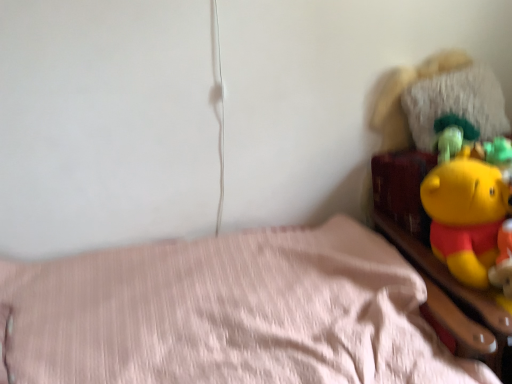
Question: Does yellow plush toy at upper right have a lesser height compared to fuzzy white pillow at upper right?

Choices:
 (A) yes
 (B) no

Answer: (B)

Question: Is fuzzy white pillow at upper right completely or partially inside yellow plush toy at upper right?

Choices:
 (A) no
 (B) yes

Answer: (A)

Question: Can you confirm if yellow plush toy at upper right is wider than fuzzy white pillow at upper right?

Choices:
 (A) no
 (B) yes

Answer: (B)

Question: Are yellow plush toy at upper right and fuzzy white pillow at upper right far apart?

Choices:
 (A) no
 (B) yes

Answer: (A)

Question: Considering the relative sizes of yellow plush toy at upper right and fuzzy white pillow at upper right in the image provided, is yellow plush toy at upper right bigger than fuzzy white pillow at upper right?

Choices:
 (A) no
 (B) yes

Answer: (B)

Question: From a real-world perspective, is yellow plush toy at upper right physically below fuzzy white pillow at upper right?

Choices:
 (A) yes
 (B) no

Answer: (A)

Question: Is the depth of yellow plush toy at upper right greater than that of pink fabric bed at lower left?

Choices:
 (A) yes
 (B) no

Answer: (A)

Question: Is yellow plush toy at upper right placed right next to pink fabric bed at lower left?

Choices:
 (A) yes
 (B) no

Answer: (B)

Question: Considering the relative positions of yellow plush toy at upper right and pink fabric bed at lower left in the image provided, is yellow plush toy at upper right to the right of pink fabric bed at lower left from the viewer's perspective?

Choices:
 (A) yes
 (B) no

Answer: (A)

Question: Is yellow plush toy at upper right not inside pink fabric bed at lower left?

Choices:
 (A) yes
 (B) no

Answer: (A)

Question: Is yellow plush toy at upper right turned away from pink fabric bed at lower left?

Choices:
 (A) yes
 (B) no

Answer: (B)

Question: Is yellow plush toy at upper right positioned in front of pink fabric bed at lower left?

Choices:
 (A) no
 (B) yes

Answer: (A)

Question: Is fuzzy white pillow at upper right surrounding pink fabric bed at lower left?

Choices:
 (A) yes
 (B) no

Answer: (B)